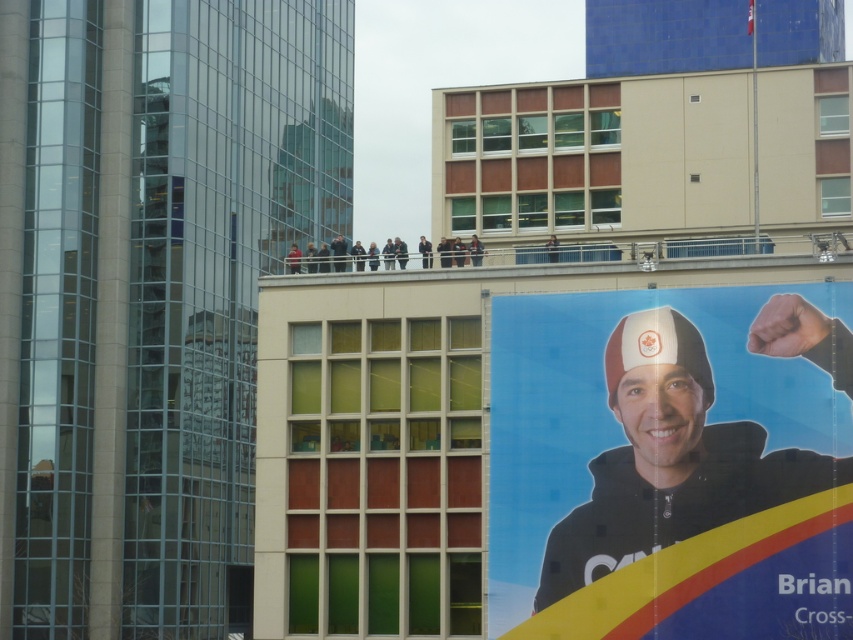
Question: Does matte black poster at right have a smaller size compared to matte black jacket at upper center?

Choices:
 (A) no
 (B) yes

Answer: (B)

Question: Is matte black poster at right bigger than matte black jacket at upper center?

Choices:
 (A) yes
 (B) no

Answer: (B)

Question: Which point appears closest to the camera in this image?

Choices:
 (A) (340, 241)
 (B) (502, 298)

Answer: (B)

Question: Can you confirm if matte black poster at right is positioned to the left of matte black jacket at upper center?

Choices:
 (A) no
 (B) yes

Answer: (A)